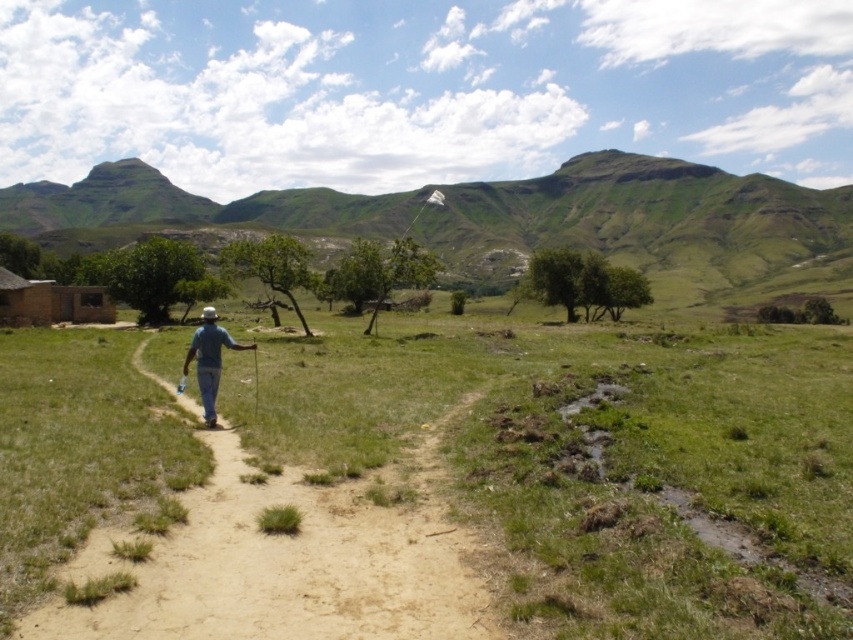
You are standing at the base of the green grassy mountain at upper center and want to take a photo of it. If your camera can focus on objects up to 300 meters away, will it be able to capture the mountain clearly?

The green grassy mountain at upper center is 323.61 meters away from the camera. Since this distance exceeds the camera maximum focus range of 300 meters, the camera will not be able to focus on the mountain and capture it clearly.

Consider the image. You are a photographer standing at the edge of the dirt path in the rural landscape. You want to capture a photo of both the green grassy at center and the blue denim jeans at center in the same frame. Which object will occupy more space in the photo?

The green grassy at center will occupy more space in the photo because it is bigger than the blue denim jeans at center.